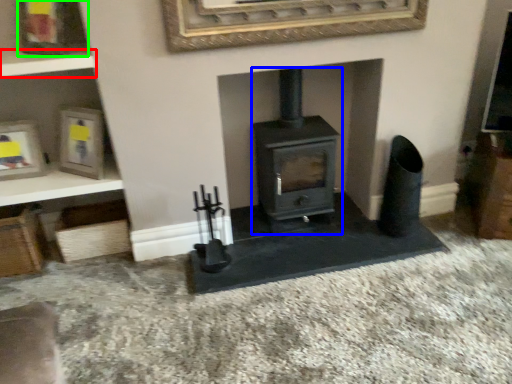
Question: Estimate the real-world distances between objects in this image. Which object is farther from shelf (highlighted by a red box), wood burning stove (highlighted by a blue box) or picture frame (highlighted by a green box)?

Choices:
 (A) wood burning stove
 (B) picture frame

Answer: (A)